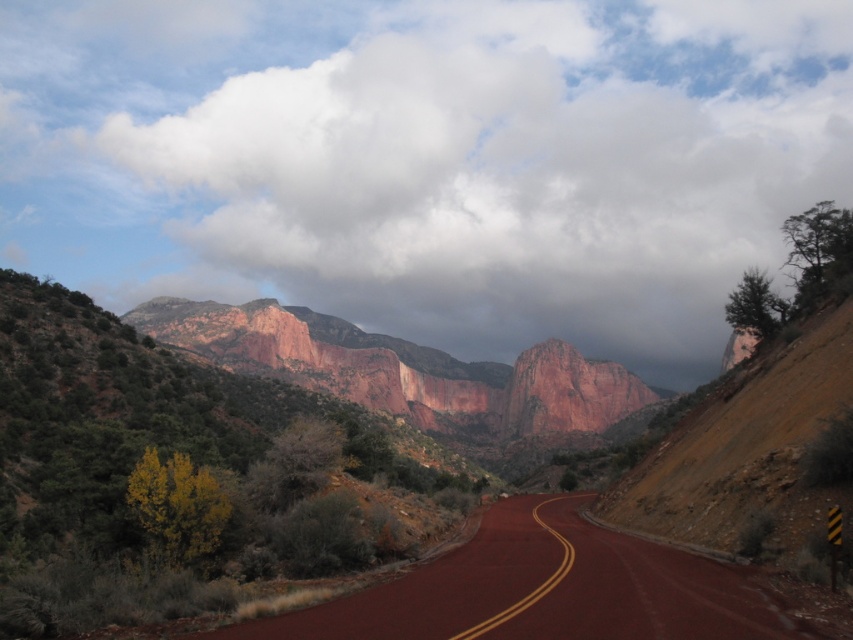
Question: Among these points, which one is nearest to the camera?

Choices:
 (A) (260, 188)
 (B) (732, 586)

Answer: (B)

Question: In this image, where is cloudy sky at upper center located relative to smooth asphalt road at center?

Choices:
 (A) above
 (B) below

Answer: (A)

Question: Which point is farther to the camera?

Choices:
 (A) (105, 13)
 (B) (552, 534)

Answer: (A)

Question: Does cloudy sky at upper center lie behind smooth asphalt road at center?

Choices:
 (A) yes
 (B) no

Answer: (A)

Question: Is cloudy sky at upper center to the right of smooth asphalt road at center from the viewer's perspective?

Choices:
 (A) yes
 (B) no

Answer: (B)